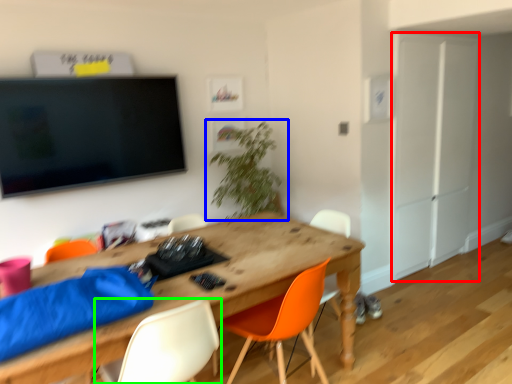
Question: Which is nearer to the armoire (highlighted by a red box)? houseplant (highlighted by a blue box) or chair (highlighted by a green box).

Choices:
 (A) houseplant
 (B) chair

Answer: (A)